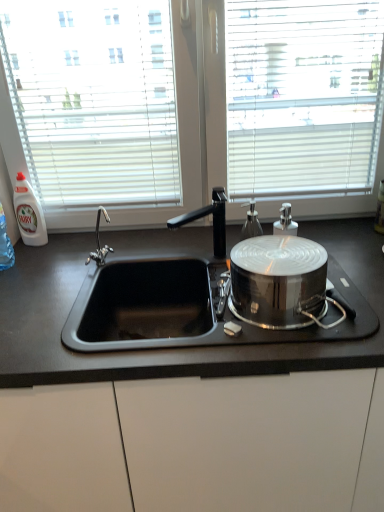
This screenshot has width=384, height=512. Describe the element at coordinates (213, 220) in the screenshot. I see `black matte faucet at center` at that location.

In the scene shown: Measure the distance between white plastic bottle at left, the 2th bottle in the front-to-back sequence, and camera.

white plastic bottle at left, the 2th bottle in the front-to-back sequence, and camera are 1.51 meters apart from each other.

Locate an element on the screen. This screenshot has width=384, height=512. polished stainless steel pot at right is located at coordinates (278, 280).

How much space does satin silver soap dispenser at center, marked as the 2th bottle in a left-to-right arrangement, occupy vertically?

satin silver soap dispenser at center, marked as the 2th bottle in a left-to-right arrangement, is 10.97 centimeters in height.

The width and height of the screenshot is (384, 512). I want to click on black matte faucet at center, so click(213, 220).

At what (x,y) coordinates should I click in order to perform the action: click on bottle on the right side of black matte faucet at center. Please return your answer as a coordinate pair (x, y). The image size is (384, 512). Looking at the image, I should click on (251, 222).

From the image's perspective, would you say black matte faucet at center is positioned over satin silver soap dispenser at center, marked as the 1th bottle in a right-to-left arrangement?

No, from the image's perspective, black matte faucet at center is not above satin silver soap dispenser at center, marked as the 1th bottle in a right-to-left arrangement.

Would you say black matte faucet at center is outside satin silver soap dispenser at center, marked as the 2th bottle in a left-to-right arrangement?

Yes, black matte faucet at center is located beyond the bounds of satin silver soap dispenser at center, marked as the 2th bottle in a left-to-right arrangement.

Considering the positions of points (168, 220) and (254, 236), is point (168, 220) farther from camera compared to point (254, 236)?

Yes, it is behind point (254, 236).

Is black matte countertop at center at the back of polished stainless steel pot at right?

polished stainless steel pot at right is not turned away from black matte countertop at center.

Does polished stainless steel pot at right touch black matte countertop at center?

No.

How many degrees apart are the facing directions of polished stainless steel pot at right and black matte countertop at center?

The angular difference between polished stainless steel pot at right and black matte countertop at center is 2.88 degrees.

From the image's perspective, which is above, polished stainless steel pot at right or black matte countertop at center?

polished stainless steel pot at right, from the image's perspective.

What's the angular difference between black matte countertop at center and white plastic bottle at left, the first bottle positioned from the back,'s facing directions?

27.4 degrees separate the facing orientations of black matte countertop at center and white plastic bottle at left, the first bottle positioned from the back.

Is white plastic bottle at left, marked as the 2th bottle in a right-to-left arrangement, inside black matte countertop at center?

No, white plastic bottle at left, marked as the 2th bottle in a right-to-left arrangement, is not a part of black matte countertop at center.

From the image's perspective, which one is positioned higher, black matte countertop at center or white plastic bottle at left, arranged as the first bottle when viewed from the left?

From the image's view, white plastic bottle at left, arranged as the first bottle when viewed from the left, is above.

At what (x,y) coordinates should I click in order to perform the action: click on the 2nd bottle above when counting from the black matte countertop at center (from the image's perspective). Please return your answer as a coordinate pair (x, y). The width and height of the screenshot is (384, 512). Looking at the image, I should click on (29, 213).

Considering the positions of objects satin silver soap dispenser at center, marked as the 1th bottle in a right-to-left arrangement, and polished stainless steel pot at right in the image provided, who is more to the right, satin silver soap dispenser at center, marked as the 1th bottle in a right-to-left arrangement, or polished stainless steel pot at right?

polished stainless steel pot at right.

How different are the orientations of satin silver soap dispenser at center, the 2th bottle when ordered from back to front, and polished stainless steel pot at right in degrees?

The facing directions of satin silver soap dispenser at center, the 2th bottle when ordered from back to front, and polished stainless steel pot at right are 2.27 degrees apart.

At what (x,y) coordinates should I click in order to perform the action: click on kitchen appliance on the right side of satin silver soap dispenser at center, marked as the 2th bottle in a left-to-right arrangement. Please return your answer as a coordinate pair (x, y). Looking at the image, I should click on (278, 280).

Which object is closer to the camera, satin silver soap dispenser at center, which is the 1th bottle in front-to-back order, or polished stainless steel pot at right?

Positioned in front is polished stainless steel pot at right.

Which object is positioned more to the right, polished stainless steel pot at right or black matte faucet at center?

polished stainless steel pot at right.

I want to click on kitchen appliance below the black matte faucet at center (from the image's perspective), so click(x=278, y=280).

Is point (233, 247) in front of point (223, 243)?

That is True.

From a real-world perspective, which is physically below, polished stainless steel pot at right or black matte faucet at center?

polished stainless steel pot at right, from a real-world perspective.

Looking at this image, is white plastic bottle at left, the first bottle positioned from the back, closer to the viewer compared to polished stainless steel pot at right?

No, white plastic bottle at left, the first bottle positioned from the back, is further to the viewer.

Which is more to the left, white plastic bottle at left, the 2th bottle in the front-to-back sequence, or polished stainless steel pot at right?

white plastic bottle at left, the 2th bottle in the front-to-back sequence, is more to the left.

Is polished stainless steel pot at right completely or partially inside white plastic bottle at left, arranged as the first bottle when viewed from the left?

No.

Can you confirm if white plastic bottle at left, the first bottle positioned from the back, is taller than polished stainless steel pot at right?

Yes.

Is satin silver soap dispenser at center, the 2th bottle when ordered from back to front, aimed at black matte countertop at center?

No, satin silver soap dispenser at center, the 2th bottle when ordered from back to front, is not aimed at black matte countertop at center.

Is black matte countertop at center completely or partially inside satin silver soap dispenser at center, which is the 1th bottle in front-to-back order?

Actually, black matte countertop at center is outside satin silver soap dispenser at center, which is the 1th bottle in front-to-back order.

Is satin silver soap dispenser at center, the 2th bottle when ordered from back to front, to the left or to the right of black matte countertop at center in the image?

Clearly, satin silver soap dispenser at center, the 2th bottle when ordered from back to front, is on the right of black matte countertop at center in the image.

From a real-world perspective, is satin silver soap dispenser at center, which is the 1th bottle in front-to-back order, below black matte countertop at center?

No.

Where is `tap directly beneath the satin silver soap dispenser at center, marked as the 1th bottle in a right-to-left arrangement (from a real-world perspective)`? tap directly beneath the satin silver soap dispenser at center, marked as the 1th bottle in a right-to-left arrangement (from a real-world perspective) is located at coordinates coord(213,220).

Find the location of `kitchen appliance above the black matte countertop at center (from the image's perspective)`. kitchen appliance above the black matte countertop at center (from the image's perspective) is located at coordinates (278, 280).

Based on their spatial positions, is polished stainless steel pot at right or black matte countertop at center closer to black matte faucet at center?

polished stainless steel pot at right is closer to black matte faucet at center.

Based on their spatial positions, is black matte faucet at center or satin silver soap dispenser at center, which is the 1th bottle in front-to-back order, further from polished stainless steel pot at right?

The object further to polished stainless steel pot at right is satin silver soap dispenser at center, which is the 1th bottle in front-to-back order.

From the picture: Which object lies further to the anchor point black matte faucet at center, black matte countertop at center or white plastic bottle at left, arranged as the first bottle when viewed from the left?

black matte countertop at center.

Looking at the image, which one is located closer to black matte faucet at center, black matte countertop at center or satin silver soap dispenser at center, which is the 1th bottle in front-to-back order?

satin silver soap dispenser at center, which is the 1th bottle in front-to-back order, is positioned closer to the anchor black matte faucet at center.

Which object lies nearer to the anchor point polished stainless steel pot at right, black matte countertop at center or black matte faucet at center?

Based on the image, black matte countertop at center appears to be nearer to polished stainless steel pot at right.

In the scene shown: Estimate the real-world distances between objects in this image. Which object is further from black matte faucet at center, white plastic bottle at left, the 2th bottle in the front-to-back sequence, or satin silver soap dispenser at center, marked as the 1th bottle in a right-to-left arrangement?

Among the two, white plastic bottle at left, the 2th bottle in the front-to-back sequence, is located further to black matte faucet at center.

When comparing their distances from satin silver soap dispenser at center, marked as the 1th bottle in a right-to-left arrangement, does white plastic bottle at left, the 2th bottle in the front-to-back sequence, or black matte countertop at center seem further?

white plastic bottle at left, the 2th bottle in the front-to-back sequence.

Considering their positions, is satin silver soap dispenser at center, the 2th bottle when ordered from back to front, positioned closer to white plastic bottle at left, arranged as the first bottle when viewed from the left, than black matte countertop at center?

black matte countertop at center is positioned closer to the anchor white plastic bottle at left, arranged as the first bottle when viewed from the left.

Locate an element on the screen. This screenshot has width=384, height=512. tap between white plastic bottle at left, the first bottle positioned from the back, and black matte countertop at center, in the horizontal direction is located at coordinates (213, 220).

At what (x,y) coordinates should I click in order to perform the action: click on tap located between polished stainless steel pot at right and satin silver soap dispenser at center, which is the 1th bottle in front-to-back order, in the depth direction. Please return your answer as a coordinate pair (x, y). Looking at the image, I should click on (213, 220).

This screenshot has height=512, width=384. Identify the location of kitchen appliance between black matte faucet at center and black matte countertop at center vertically. (278, 280).

Find the location of `countertop between white plastic bottle at left, arranged as the first bottle when viewed from the left, and polished stainless steel pot at right`. countertop between white plastic bottle at left, arranged as the first bottle when viewed from the left, and polished stainless steel pot at right is located at coordinates (186, 404).